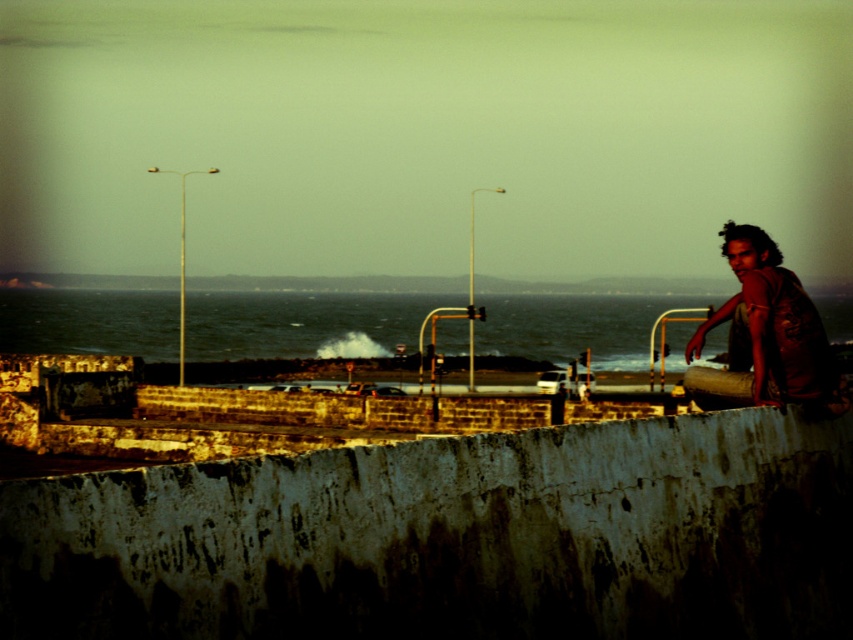
Does dark blue water at center have a lesser width compared to brown textured shirt at right?

In fact, dark blue water at center might be wider than brown textured shirt at right.

Who is more forward, (616, 332) or (773, 294)?

Point (773, 294) is in front.

Where is `dark blue water at center`? This screenshot has height=640, width=853. dark blue water at center is located at coordinates (302, 324).

Between rusty concrete barrier at lower center and dark blue water at center, which one appears on the right side from the viewer's perspective?

rusty concrete barrier at lower center

Between point (164, 508) and point (151, 320), which one is positioned in front?

Point (164, 508) is more forward.

This screenshot has width=853, height=640. Identify the location of rusty concrete barrier at lower center. (453, 538).

Consider the image. Who is more distant from viewer, (614, 595) or (741, 365)?

Point (741, 365)

Does point (6, 564) lie in front of point (787, 381)?

That is True.

Identify the location of rusty concrete barrier at lower center. (453, 538).